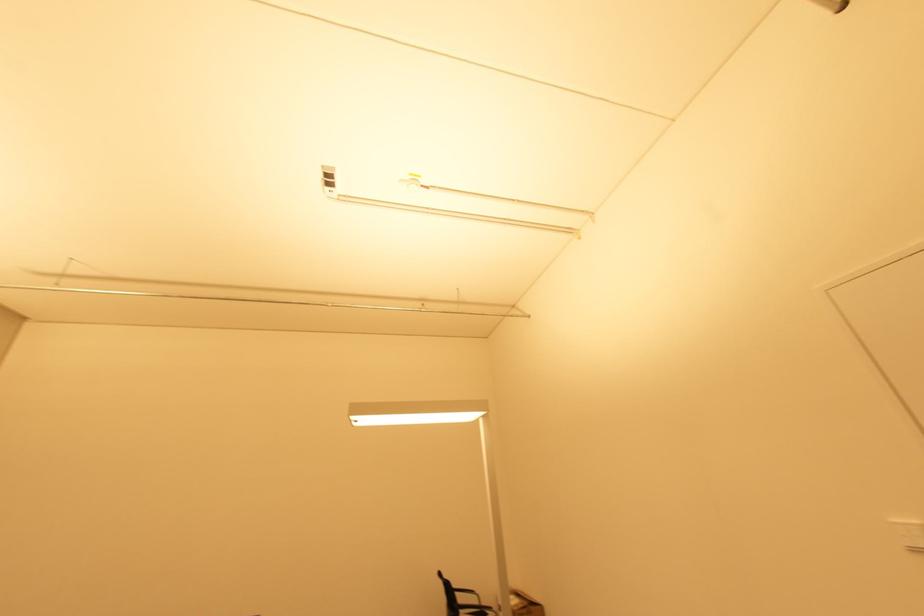
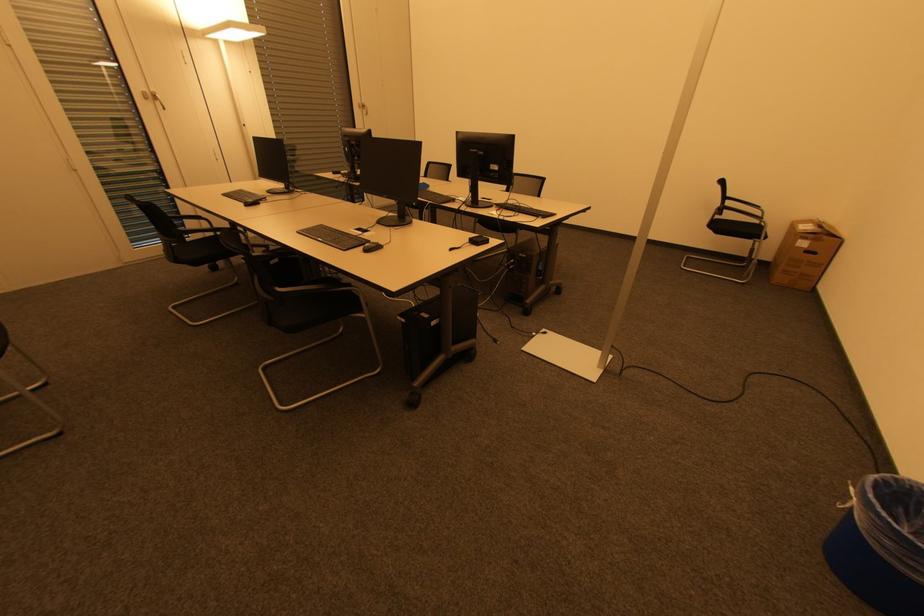
Based on the continuous images, in which direction is the camera rotating?

The camera rotated toward left-down.